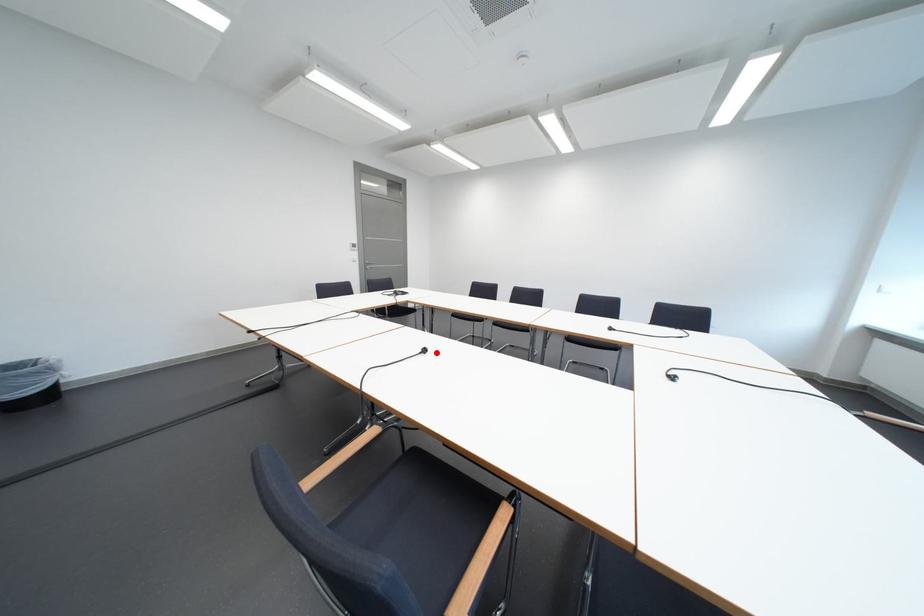
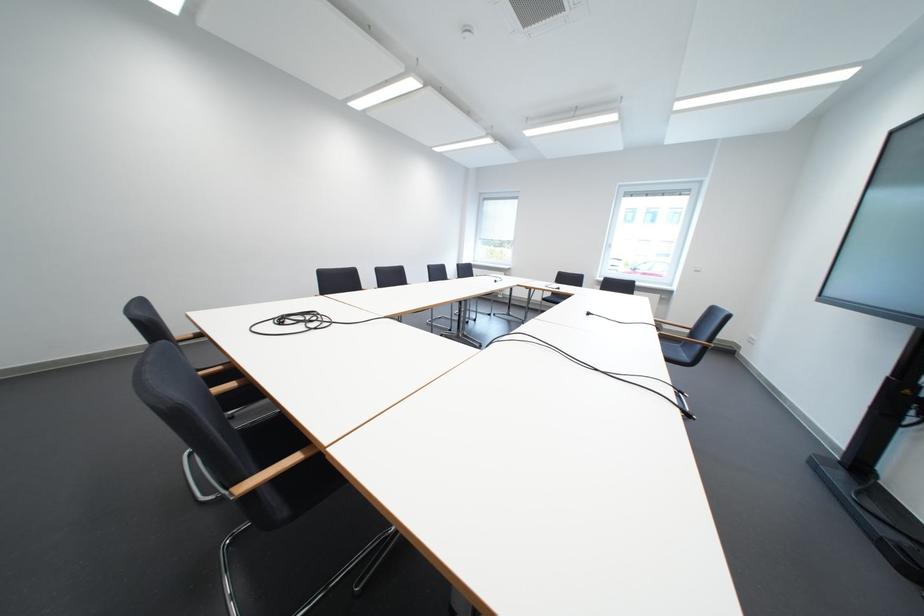
Question: I am providing you with two images of the same scene from different viewpoints. In image1, a red point is highlighted. Considering the same 3D point in image2, which of the following is correct?

Choices:
 (A) It is closer
 (B) It is farther

Answer: (B)